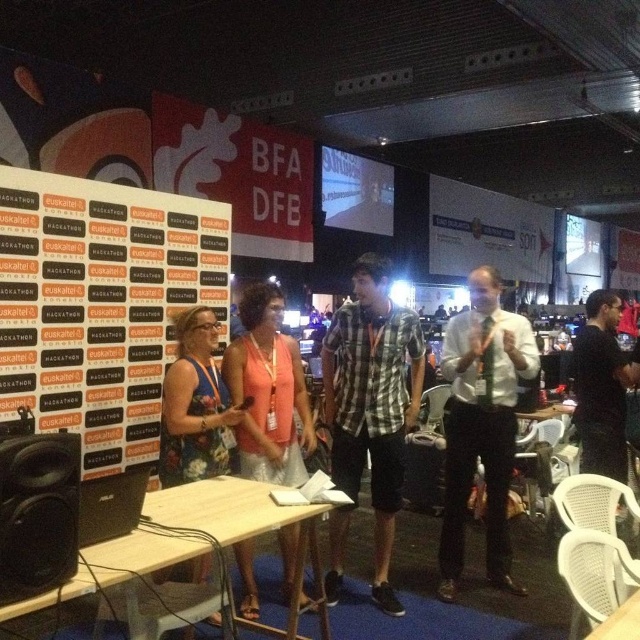
Does point (257, 412) come in front of point (612, 371)?

Yes, point (257, 412) is closer to viewer.

Between orange fabric dress at center and black shirt at right, which one is positioned higher?

black shirt at right is above.

Does point (282, 451) lie behind point (582, 340)?

No, (282, 451) is in front of (582, 340).

You are a GUI agent. You are given a task and a screenshot of the screen. Output one action in this format:
    pyautogui.click(x=<x>, y=<y>)
    Task: Click on the orange fabric dress at center
    Image resolution: width=640 pixels, height=640 pixels.
    Given the screenshot: What is the action you would take?
    pyautogui.click(x=268, y=392)

Measure the distance between white shirt at center and black shirt at right.

white shirt at center and black shirt at right are 34.30 inches apart from each other.

Can you confirm if white shirt at center is positioned to the left of black shirt at right?

Yes, white shirt at center is to the left of black shirt at right.

The height and width of the screenshot is (640, 640). I want to click on white shirt at center, so click(481, 422).

Where is `white shirt at center`? white shirt at center is located at coordinates (481, 422).

Is white shirt at center closer to the viewer compared to orange fabric dress at center?

No, white shirt at center is behind orange fabric dress at center.

Is point (467, 436) less distant than point (262, 312)?

No, (467, 436) is further to viewer.

Find the location of a particular element. white shirt at center is located at coordinates (481, 422).